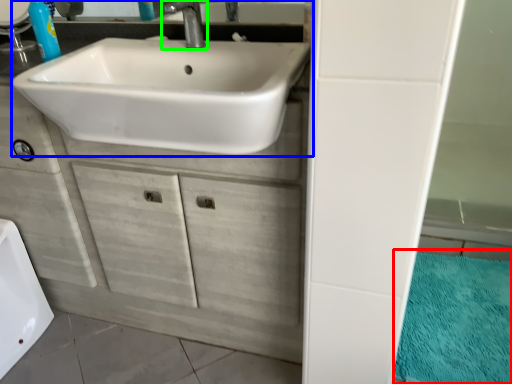
Question: Considering the real-world distances, which object is closest to bath mat (highlighted by a red box)? sink (highlighted by a blue box) or tap (highlighted by a green box).

Choices:
 (A) sink
 (B) tap

Answer: (A)